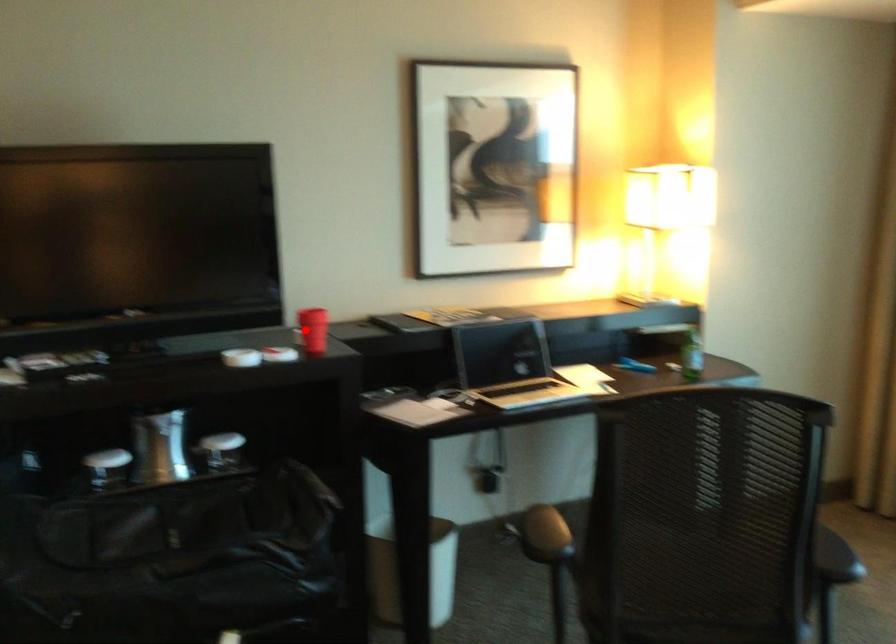
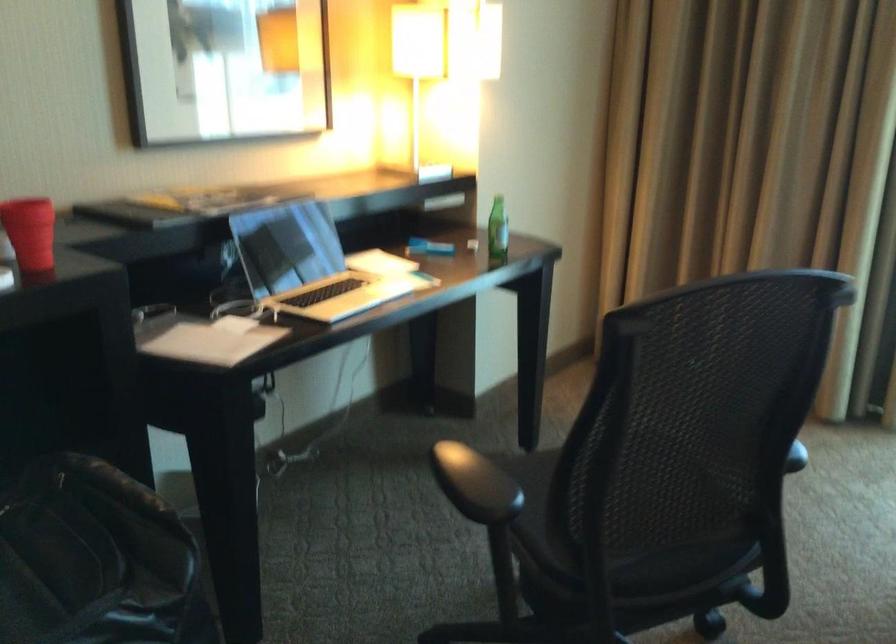
Question: I am providing you with two images of the same scene from different viewpoints. A red point is shown in image1. For the corresponding object point in image2, is it positioned nearer or farther from the camera?

Choices:
 (A) Nearer
 (B) Farther

Answer: (A)